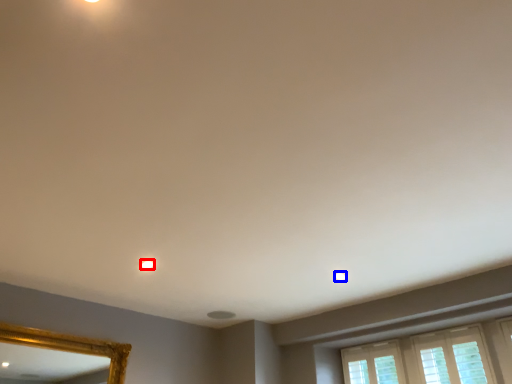
Question: Among these objects, which one is farthest to the camera, lighting (highlighted by a red box) or light (highlighted by a blue box)?

Choices:
 (A) lighting
 (B) light

Answer: (B)